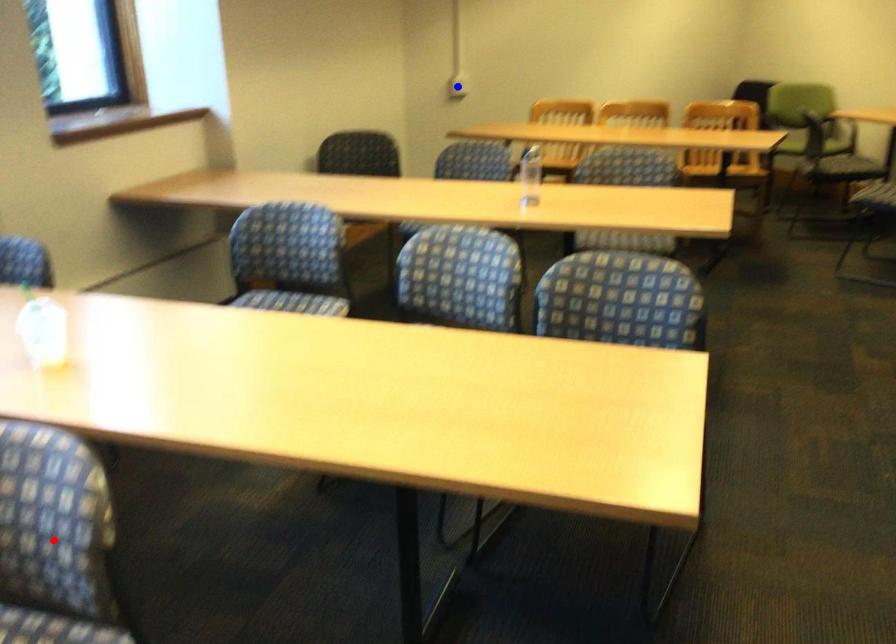
Question: Which of the two points in the image is closer to the camera?

Choices:
 (A) Blue point is closer.
 (B) Red point is closer.

Answer: (B)